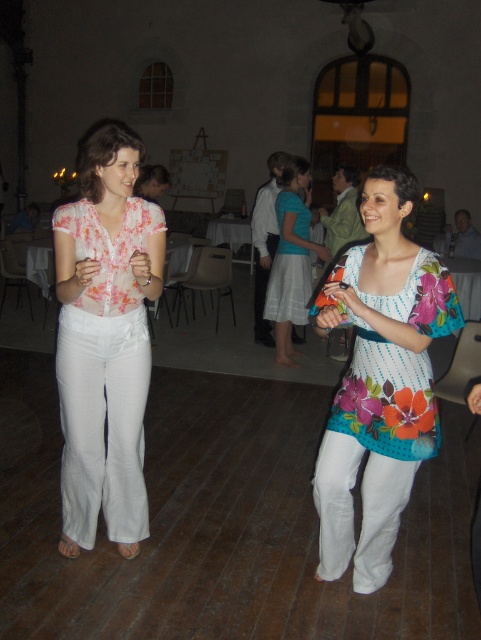
Question: Is floral printed blouse at center thinner than light blue fabric skirt at center?

Choices:
 (A) yes
 (B) no

Answer: (A)

Question: Does floral printed blouse at center appear over white striped dress at center?

Choices:
 (A) yes
 (B) no

Answer: (B)

Question: Which of the following is the farthest from the observer?

Choices:
 (A) (300, 308)
 (B) (432, 333)
 (C) (402, 410)
 (D) (304, 259)

Answer: (A)

Question: Which point appears closest to the camera in this image?

Choices:
 (A) (367, 397)
 (B) (278, 296)
 (C) (138, 330)
 (D) (300, 214)

Answer: (A)

Question: Which point is closer to the camera taking this photo?

Choices:
 (A) (307, 272)
 (B) (325, 464)
 (C) (302, 202)

Answer: (B)

Question: Is floral fabric blouse at center above light blue fabric skirt at center?

Choices:
 (A) no
 (B) yes

Answer: (A)